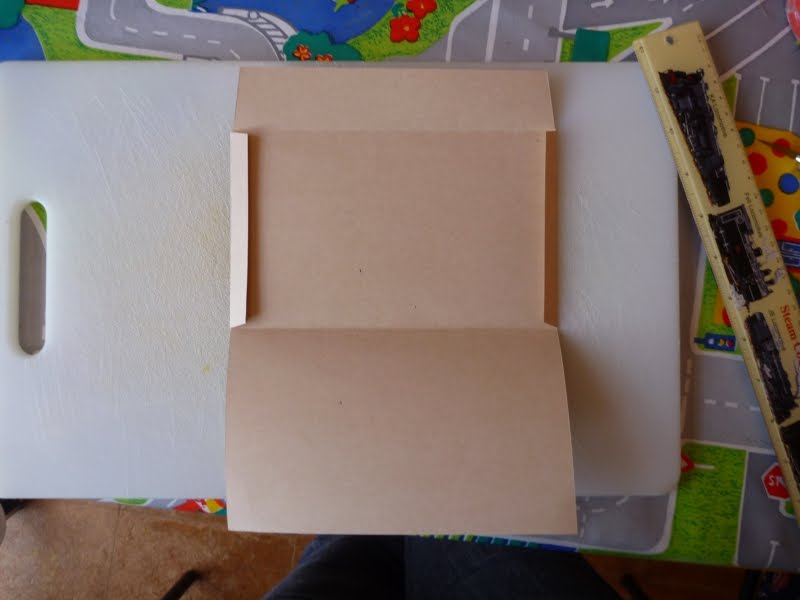
Identify the location of pond on rug design. The height and width of the screenshot is (600, 800). (338, 20).